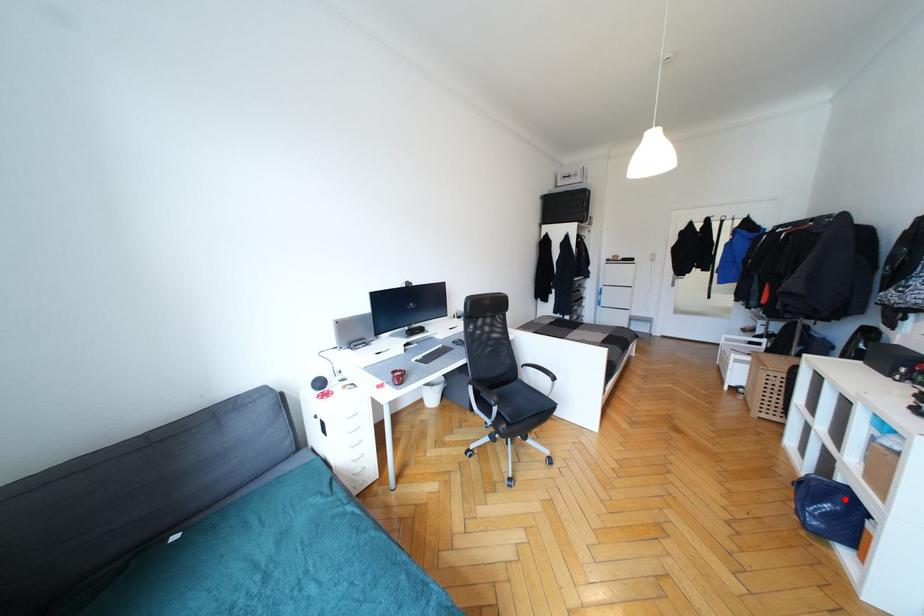
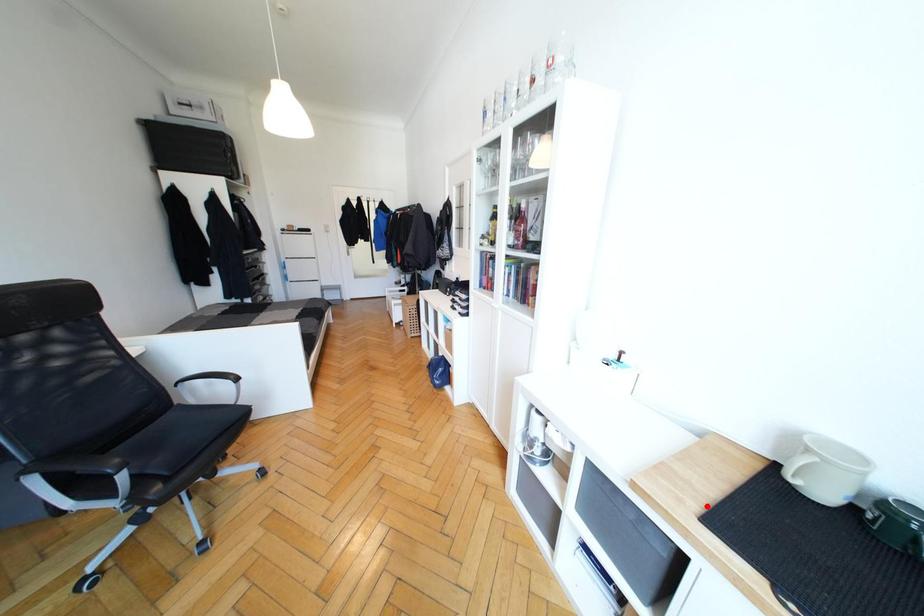
I am providing you with two images of the same scene from different viewpoints. A red point is marked on the first image and another point is marked on the second image. Are the points marked in image1 and image2 representing the same 3D position?

No